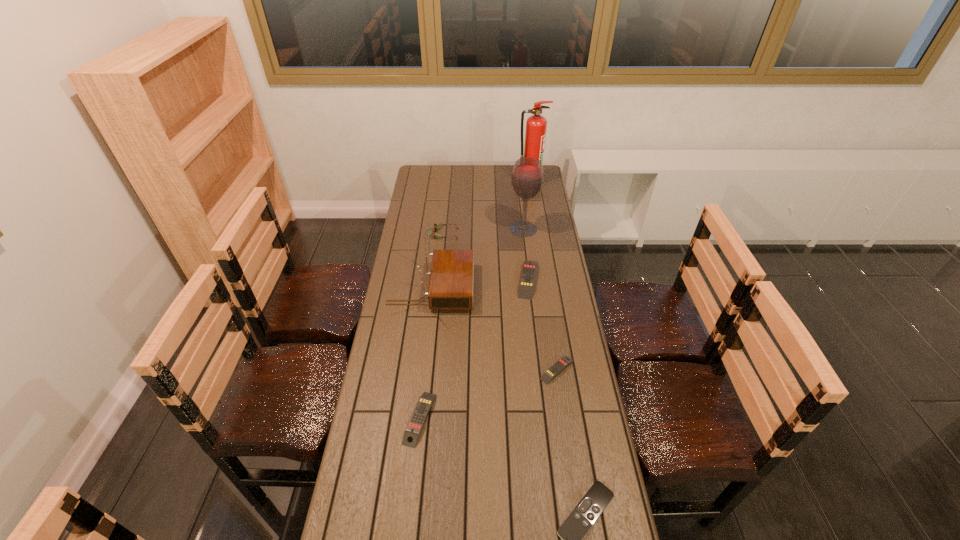
You are a GUI agent. You are given a task and a screenshot of the screen. Output one action in this format:
    pyautogui.click(x=<x>, y=<y>)
    Task: Click on the vacant area that lies between the red alcohol and the nearest yellow remote control
    The height and width of the screenshot is (540, 960).
    Given the screenshot: What is the action you would take?
    pyautogui.click(x=471, y=324)

Locate an element on the screen. Image resolution: width=960 pixels, height=540 pixels. free space between the alcohol and the spectacles is located at coordinates (483, 232).

The height and width of the screenshot is (540, 960). Find the location of `free space between the farthest remote control and the radio_receiver`. free space between the farthest remote control and the radio_receiver is located at coordinates (480, 284).

You are a GUI agent. You are given a task and a screenshot of the screen. Output one action in this format:
    pyautogui.click(x=<x>, y=<y>)
    Task: Click on the free spot between the spectacles and the leftmost yellow remote control
    The height and width of the screenshot is (540, 960).
    Given the screenshot: What is the action you would take?
    pyautogui.click(x=431, y=327)

This screenshot has width=960, height=540. What are the coordinates of `empty space that is in between the fourth tallest object and the second tallest object` in the screenshot? It's located at (483, 232).

Where is `object that is the third closest to the shortest remote control`? object that is the third closest to the shortest remote control is located at coordinates (450, 287).

The height and width of the screenshot is (540, 960). I want to click on object that is the sixth closest to the leftmost yellow remote control, so click(x=527, y=178).

Point out which remote control is positioned as the third nearest to the smallest yellow remote control. Please provide its 2D coordinates. Your answer should be formatted as a tuple, i.e. [(x, y)], where the tuple contains the x and y coordinates of a point satisfying the conditions above.

[(424, 404)]

Select which remote control appears as the closest to the sixth farthest object. Please provide its 2D coordinates. Your answer should be formatted as a tuple, i.e. [(x, y)], where the tuple contains the x and y coordinates of a point satisfying the conditions above.

[(529, 268)]

At what (x,y) coordinates should I click in order to perform the action: click on yellow remote control object that ranks as the third closest to the red alcohol. Please return your answer as a coordinate pair (x, y). The width and height of the screenshot is (960, 540). Looking at the image, I should click on (424, 404).